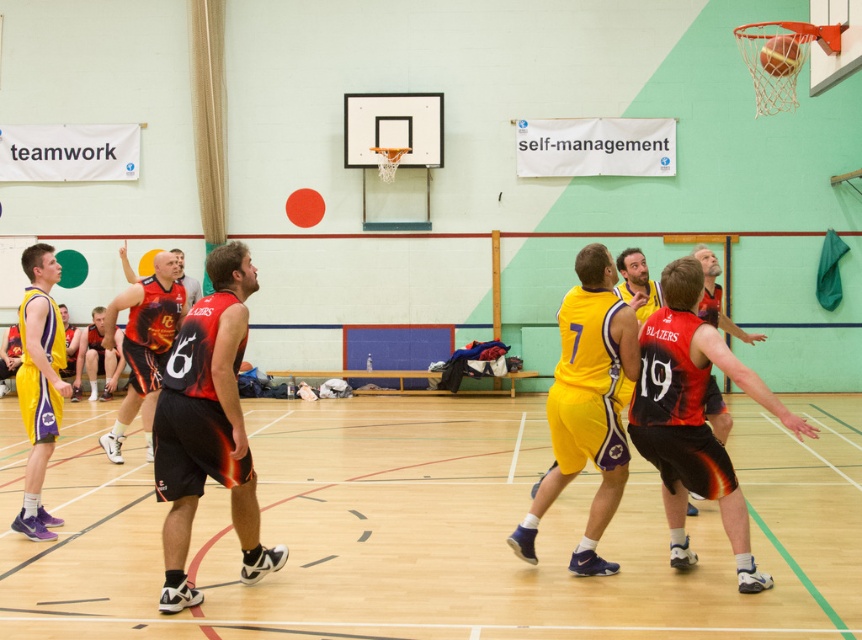
Which of these two, reddish-black jersey at center or reddish-orange jersey at center, stands shorter?

reddish-black jersey at center

Is point (798, 433) closer to viewer compared to point (109, 440)?

That is True.

Identify the location of reddish-black jersey at center. coord(692,417).

Is reddish-black jersey at center thinner than matte yellow jersey at left?

No, reddish-black jersey at center is not thinner than matte yellow jersey at left.

Who is shorter, reddish-black jersey at center or matte yellow jersey at left?

reddish-black jersey at center

Who is more distant from viewer, (659,339) or (39,442)?

The point (39,442) is more distant.

Locate an element on the screen. This screenshot has width=862, height=640. reddish-black jersey at center is located at coordinates (692, 417).

Is yellow matte shorts at center further to the viewer compared to reddish-orange jersey at center?

No.

Who is more forward, (564, 358) or (147, 356)?

Point (564, 358)

Describe the element at coordinates (586, 404) in the screenshot. I see `yellow matte shorts at center` at that location.

This screenshot has height=640, width=862. I want to click on yellow matte shorts at center, so click(586, 404).